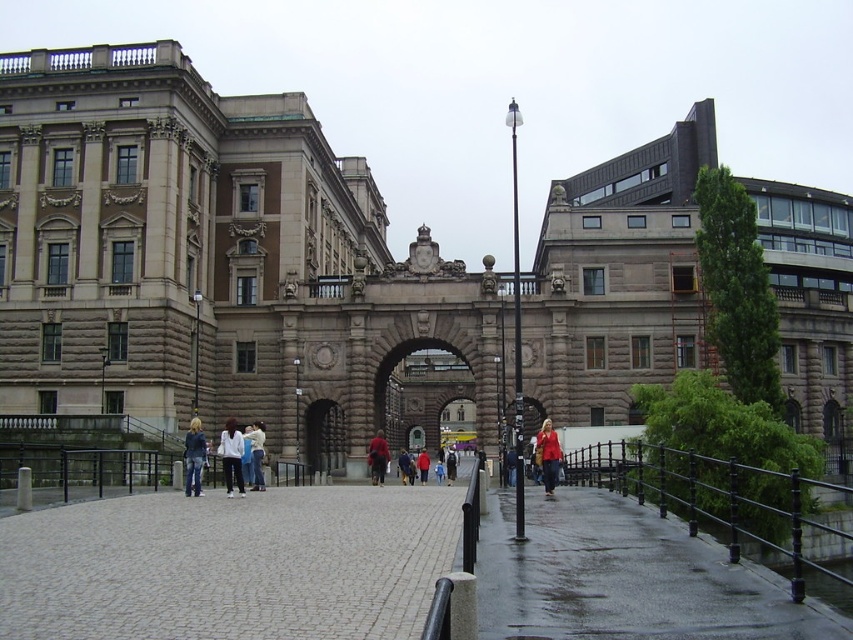
Is red fabric coat at center to the right of dark blue jeans at center from the viewer's perspective?

No, red fabric coat at center is not to the right of dark blue jeans at center.

Is red fabric coat at center smaller than dark blue jeans at center?

Yes, red fabric coat at center is smaller than dark blue jeans at center.

At what (x,y) coordinates should I click in order to perform the action: click on red fabric coat at center. Please return your answer as a coordinate pair (x, y). The image size is (853, 640). Looking at the image, I should click on (376, 458).

Which is behind, point (613, 598) or point (190, 474)?

The point (190, 474) is more distant.

Locate an element on the screen. This screenshot has width=853, height=640. wet concrete pavement at lower right is located at coordinates (625, 579).

Where is `wet concrete pavement at lower right`? The width and height of the screenshot is (853, 640). wet concrete pavement at lower right is located at coordinates (625, 579).

Does brown stone archway at center appear on the right side of red matte jacket at center?

Yes, brown stone archway at center is to the right of red matte jacket at center.

Does brown stone archway at center have a larger size compared to red matte jacket at center?

Correct, brown stone archway at center is larger in size than red matte jacket at center.

Between point (412, 376) and point (421, 467), which one is positioned behind?

The point (412, 376) is more distant.

I want to click on brown stone archway at center, so click(x=427, y=397).